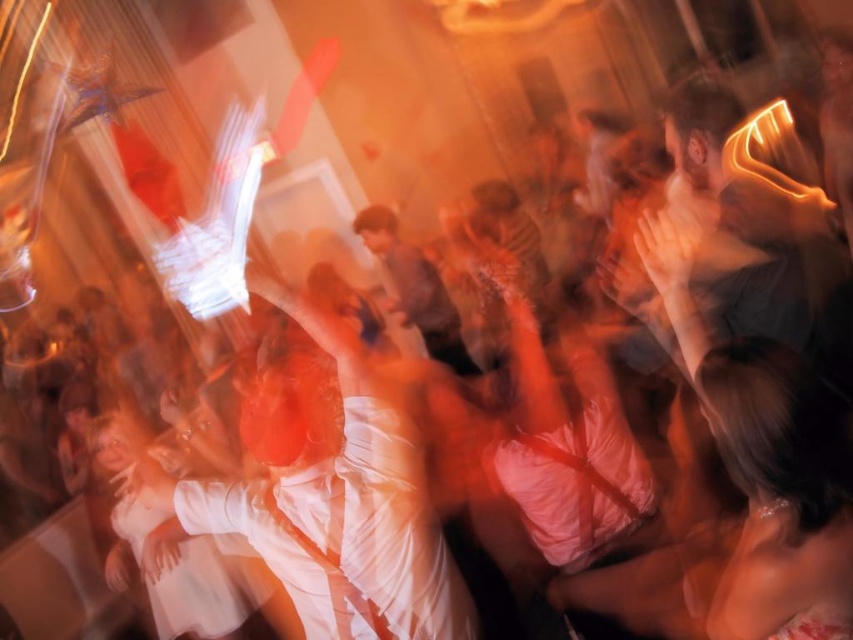
You are a photographer trying to capture the perfect shot of the white satin dress at center at a festive event. The stage has a grid system where coordinates are measured from the bottom left corner. The dress is at point 0.784, 0.389. If your camera is positioned at point 0.5, 0.5, which direction should you move your camera to align it with the dress?

To align the camera at (426, 320) with the white satin dress at center at (331, 500), you should move the camera northeast. This is because the dress is northeast of the camera position.

You are a photographer positioned at the front of the scene. You want to capture a closeup shot of the white satin dress at center. Considering your current position, can you estimate how far you need to move forward to get a clear closeup without moving the subject?

The white satin dress at center is 6.51 feet away from the viewer. To capture a closeup, you would need to move forward approximately 6.51 feet closer to the dress.